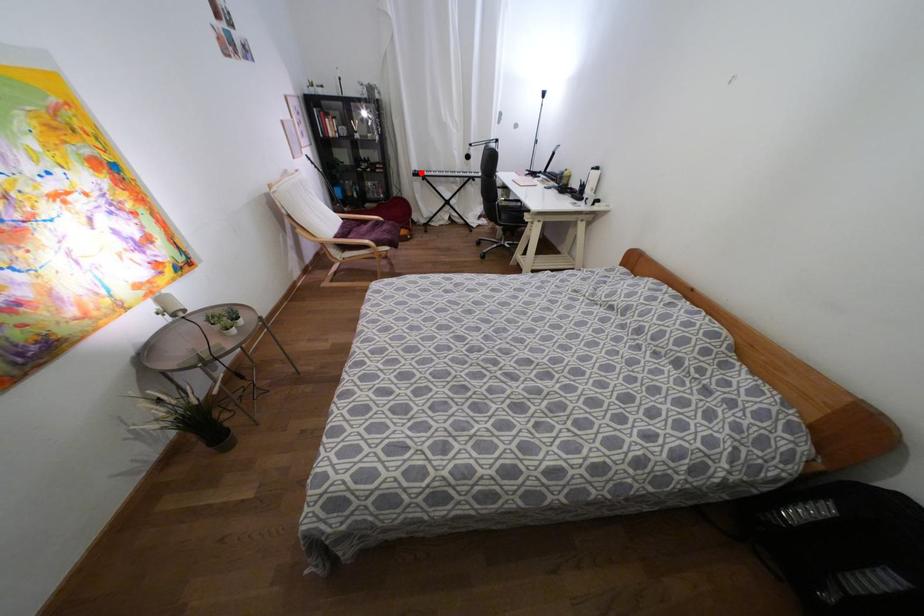
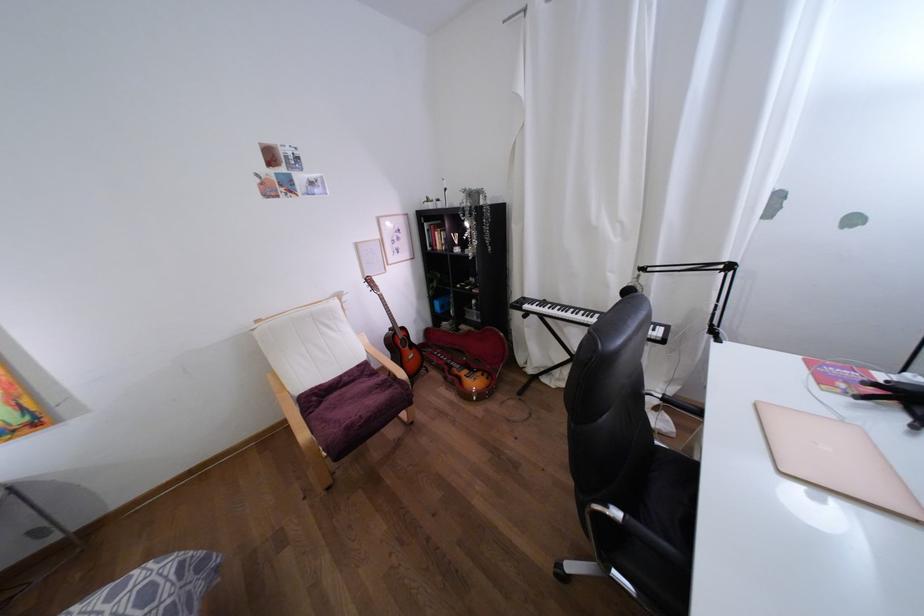
Question: I am providing you with two images of the same scene from different viewpoints. In image1, a red point is highlighted. Considering the same 3D point in image2, which of the following is correct?

Choices:
 (A) It is closer
 (B) It is farther

Answer: (B)